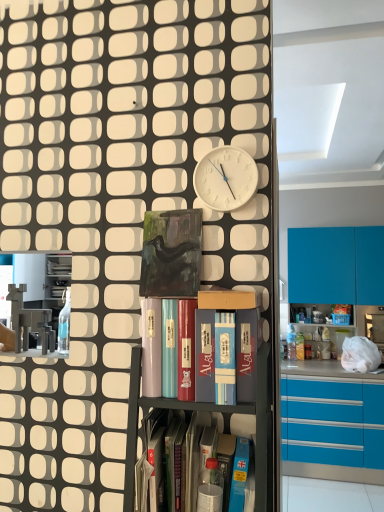
Question: Is metallic gray bookshelf at center, which is counted as the 3th shelf, starting from the right, not near white matte clock at upper center?

Choices:
 (A) no
 (B) yes

Answer: (A)

Question: From a real-world perspective, is metallic gray bookshelf at center, which ranks as the second shelf in left-to-right order, located higher than white matte clock at upper center?

Choices:
 (A) no
 (B) yes

Answer: (A)

Question: Is metallic gray bookshelf at center, which ranks as the second shelf in left-to-right order, to the left of white matte clock at upper center from the viewer's perspective?

Choices:
 (A) no
 (B) yes

Answer: (B)

Question: From the image's perspective, does metallic gray bookshelf at center, which ranks as the second shelf in left-to-right order, appear higher than white matte clock at upper center?

Choices:
 (A) yes
 (B) no

Answer: (B)

Question: From a real-world perspective, is metallic gray bookshelf at center, which is counted as the 3th shelf, starting from the right, located beneath white matte clock at upper center?

Choices:
 (A) yes
 (B) no

Answer: (A)

Question: Is metallic gray bookshelf at center, which ranks as the second shelf in left-to-right order, to the right of white matte clock at upper center from the viewer's perspective?

Choices:
 (A) no
 (B) yes

Answer: (A)

Question: Is blue glossy cupboard at center at the left side of matte cardboard box at center, placed as the second shelf when sorted from right to left?

Choices:
 (A) yes
 (B) no

Answer: (A)

Question: From the image's perspective, does blue glossy cupboard at center appear lower than matte cardboard box at center, which is the third shelf in left-to-right order?

Choices:
 (A) no
 (B) yes

Answer: (A)

Question: Is blue glossy cupboard at center located outside matte cardboard box at center, which is the third shelf in left-to-right order?

Choices:
 (A) yes
 (B) no

Answer: (A)

Question: Is matte cardboard box at center, placed as the second shelf when sorted from right to left, located within blue glossy cupboard at center?

Choices:
 (A) no
 (B) yes

Answer: (A)

Question: Is blue glossy cupboard at center in front of matte cardboard box at center, placed as the second shelf when sorted from right to left?

Choices:
 (A) no
 (B) yes

Answer: (A)

Question: Could you tell me if blue glossy cupboard at center is facing matte cardboard box at center, which is the third shelf in left-to-right order?

Choices:
 (A) no
 (B) yes

Answer: (B)

Question: Can you confirm if white matte clock at upper center is taller than blue glossy cupboard at center?

Choices:
 (A) no
 (B) yes

Answer: (A)